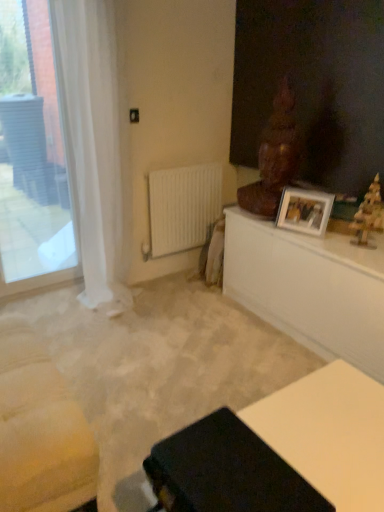
The image size is (384, 512). I want to click on free space in front of wooden christmas tree at right, marked as the first sculpture in a front-to-back arrangement, so click(x=367, y=254).